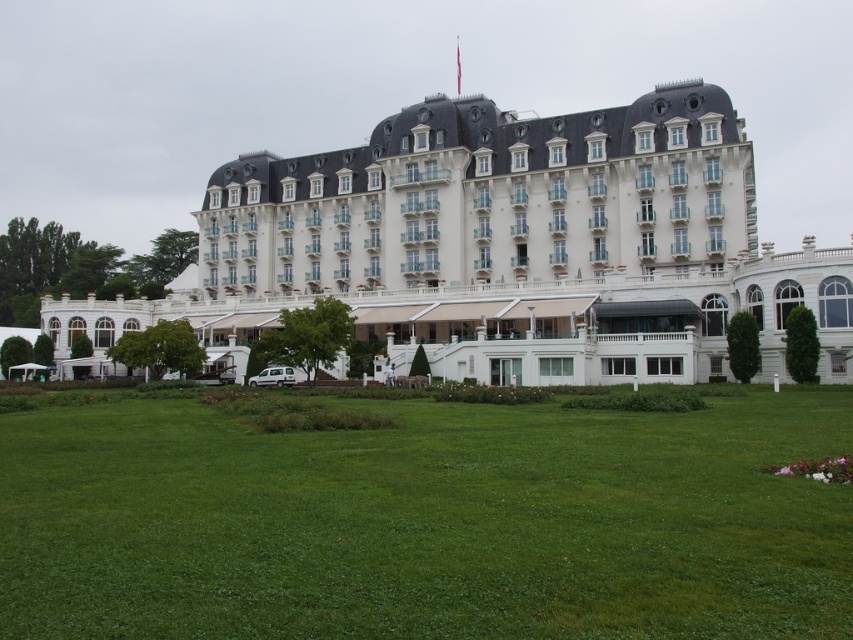
Who is shorter, green grass at lower center or white glossy building at center?

With less height is green grass at lower center.

Locate an element on the screen. The image size is (853, 640). green grass at lower center is located at coordinates (426, 522).

Locate an element on the screen. The width and height of the screenshot is (853, 640). green grass at lower center is located at coordinates (426, 522).